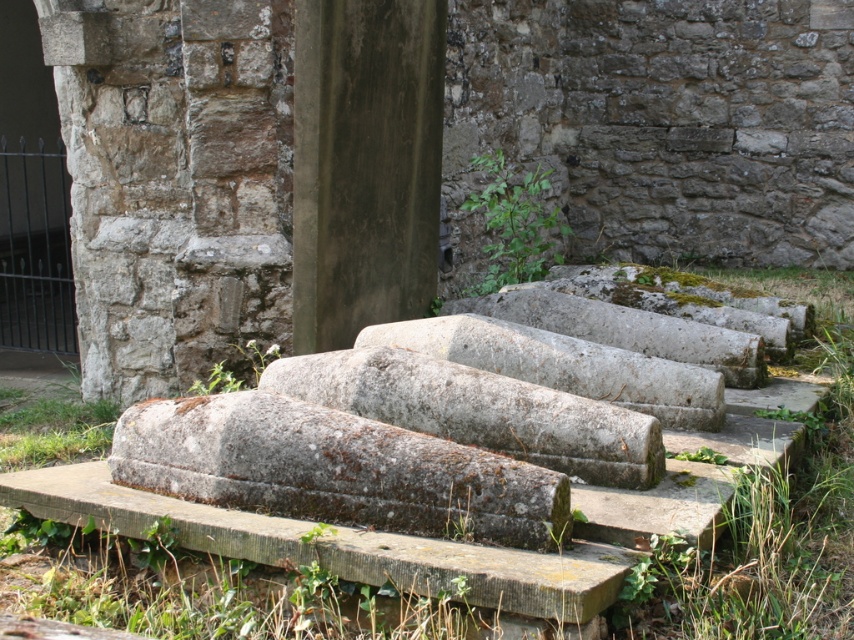
Does gray stone sarcophagi at center have a greater width compared to green mossy grass at center?

In fact, gray stone sarcophagi at center might be narrower than green mossy grass at center.

Can you confirm if gray stone sarcophagi at center is taller than green mossy grass at center?

Yes.

You are a GUI agent. You are given a task and a screenshot of the screen. Output one action in this format:
    pyautogui.click(x=<x>, y=<y>)
    Task: Click on the gray stone sarcophagi at center
    This screenshot has height=640, width=854.
    Given the screenshot: What is the action you would take?
    pyautogui.click(x=661, y=124)

Find the location of a particular element. gray stone sarcophagi at center is located at coordinates (661, 124).

Which is below, green mossy grass at center or smooth concrete pillar at center?

green mossy grass at center is below.

Is point (800, 630) closer to viewer compared to point (329, 172)?

Yes, point (800, 630) is closer to viewer.

Locate an element on the screen. green mossy grass at center is located at coordinates (776, 512).

Does gray stone sarcophagi at center appear over smooth concrete pillar at center?

Incorrect, gray stone sarcophagi at center is not positioned above smooth concrete pillar at center.

Can you confirm if gray stone sarcophagi at center is positioned to the left of smooth concrete pillar at center?

Yes, gray stone sarcophagi at center is to the left of smooth concrete pillar at center.

Find the location of a particular element. gray stone sarcophagi at center is located at coordinates (661, 124).